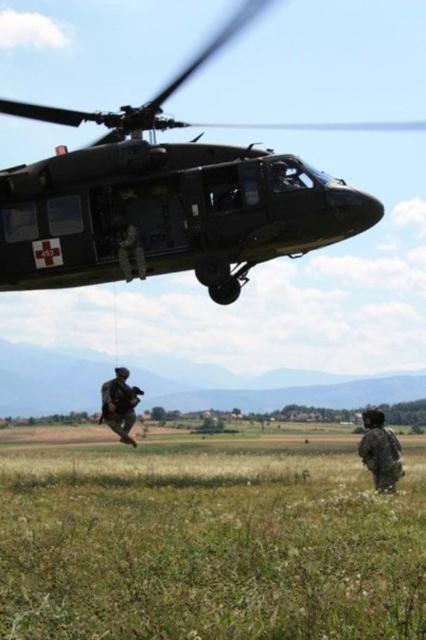
Who is higher up, camouflage uniform at lower right or camouflage uniform at center?

camouflage uniform at center is higher up.

Which of these two, camouflage uniform at lower right or camouflage uniform at center, stands taller?

camouflage uniform at center

Between point (391, 435) and point (129, 444), which one is positioned in front?

Positioned in front is point (391, 435).

You are a GUI agent. You are given a task and a screenshot of the screen. Output one action in this format:
    pyautogui.click(x=<x>, y=<y>)
    Task: Click on the camouflage uniform at lower right
    The height and width of the screenshot is (640, 426).
    Given the screenshot: What is the action you would take?
    tap(379, 451)

Describe the element at coordinates (166, 198) in the screenshot. I see `matte black helicopter at upper center` at that location.

Who is more forward, (192,179) or (103,387)?

Point (192,179) is more forward.

Where is `matte black helicopter at upper center`? The width and height of the screenshot is (426, 640). matte black helicopter at upper center is located at coordinates (166, 198).

Does matte black helicopter at upper center appear on the right side of camouflage uniform at lower right?

In fact, matte black helicopter at upper center is to the left of camouflage uniform at lower right.

Is matte black helicopter at upper center shorter than camouflage uniform at lower right?

Indeed, matte black helicopter at upper center has a lesser height compared to camouflage uniform at lower right.

What do you see at coordinates (166, 198) in the screenshot? I see `matte black helicopter at upper center` at bounding box center [166, 198].

I want to click on matte black helicopter at upper center, so click(x=166, y=198).